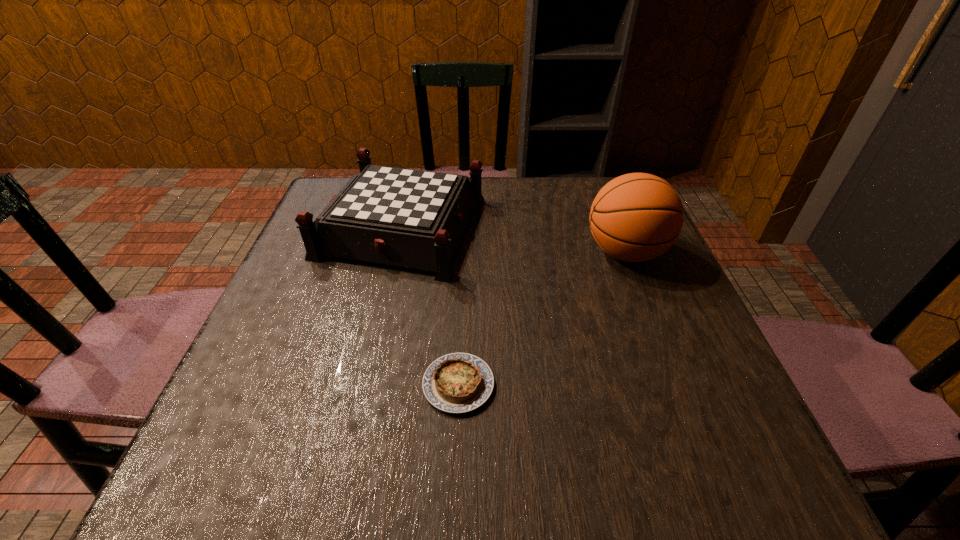
In order to click on object that is at the right edge in this screenshot , I will do `click(636, 217)`.

Identify the location of object located in the far left corner section of the desktop. (409, 218).

You are a GUI agent. You are given a task and a screenshot of the screen. Output one action in this format:
    pyautogui.click(x=<x>, y=<y>)
    Task: Click on the vacant space at the far edge
    The height and width of the screenshot is (540, 960).
    Given the screenshot: What is the action you would take?
    pyautogui.click(x=561, y=221)

This screenshot has height=540, width=960. I want to click on blank space at the left edge, so click(x=329, y=284).

You are a GUI agent. You are given a task and a screenshot of the screen. Output one action in this format:
    pyautogui.click(x=<x>, y=<y>)
    Task: Click on the vacant space at the right edge of the desktop
    
    Given the screenshot: What is the action you would take?
    pyautogui.click(x=640, y=301)

The image size is (960, 540). I want to click on free space at the far left corner of the desktop, so click(325, 194).

Locate an element on the screen. free region at the near left corner of the desktop is located at coordinates (246, 456).

Locate an element on the screen. free space at the far right corner of the desktop is located at coordinates (589, 208).

This screenshot has width=960, height=540. Find the location of `free space between the checkerboard and the basketball`. free space between the checkerboard and the basketball is located at coordinates (514, 240).

At what (x,y) coordinates should I click in order to perform the action: click on free space between the rightmost object and the nearest object. Please return your answer as a coordinate pair (x, y). This screenshot has width=960, height=540. Looking at the image, I should click on (542, 319).